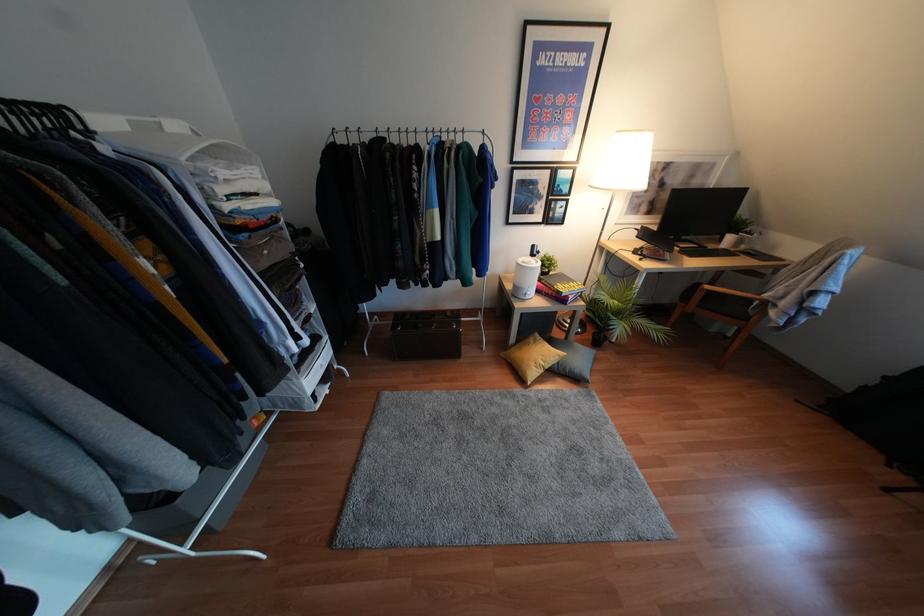
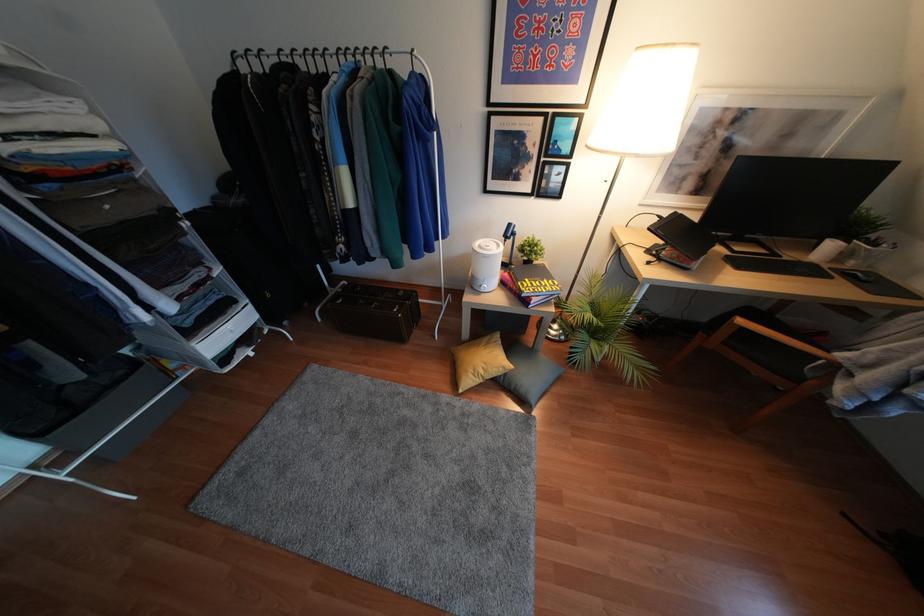
In the second image, find the point that corresponds to (x=430, y=135) in the first image.

(342, 59)